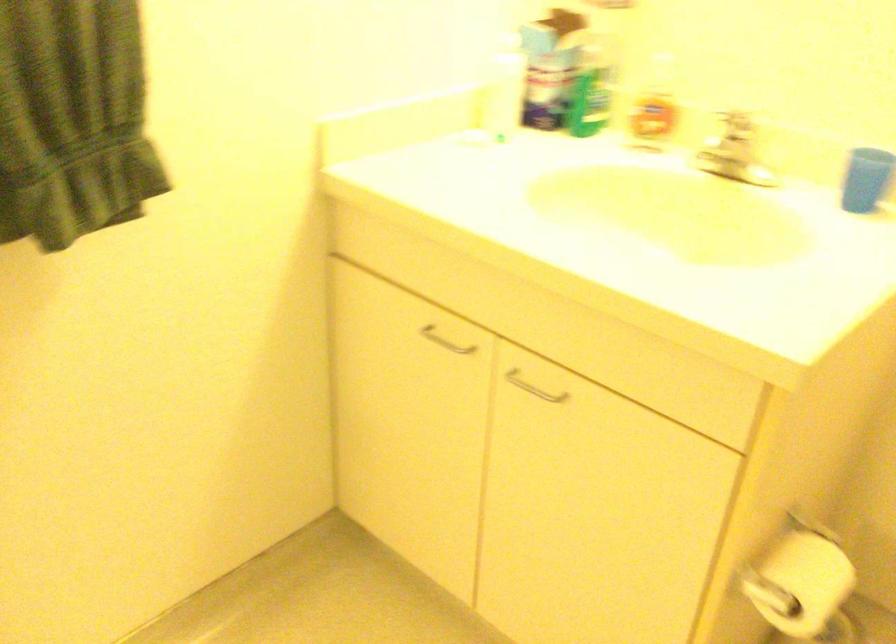
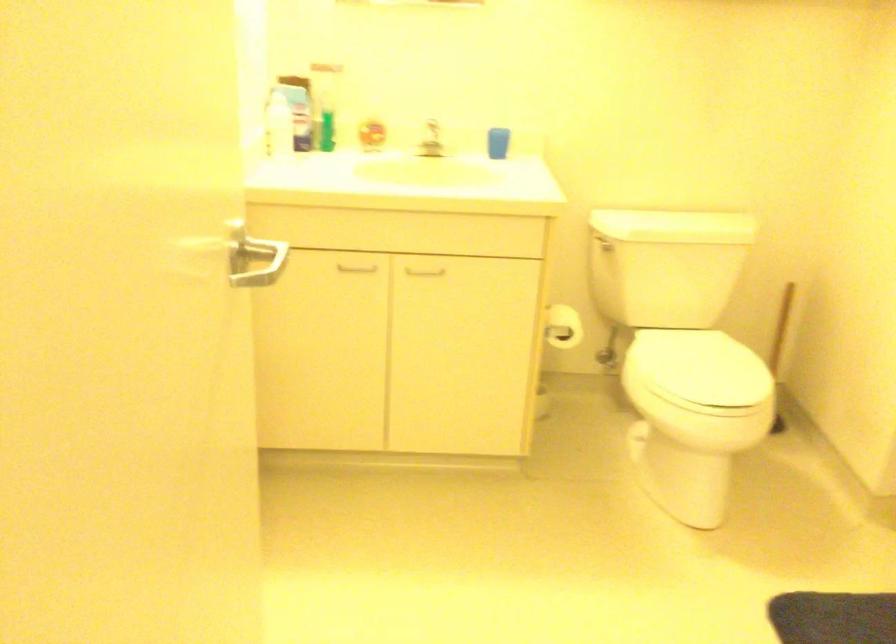
Find the pixel in the second image that matches point (710, 164) in the first image.

(431, 140)